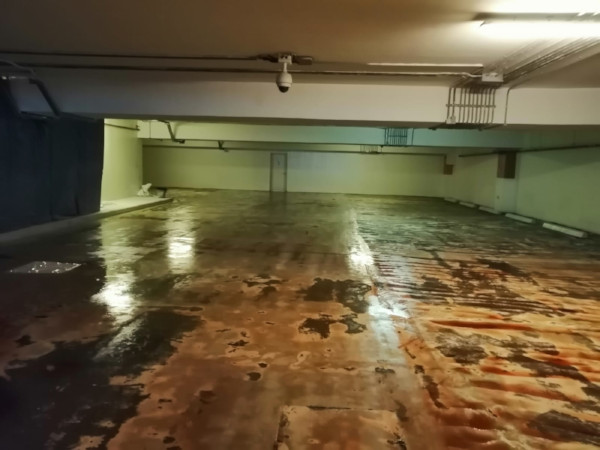
Locate an element on the screen. The height and width of the screenshot is (450, 600). dark brown wooden rusted looking floor is located at coordinates (262, 326).